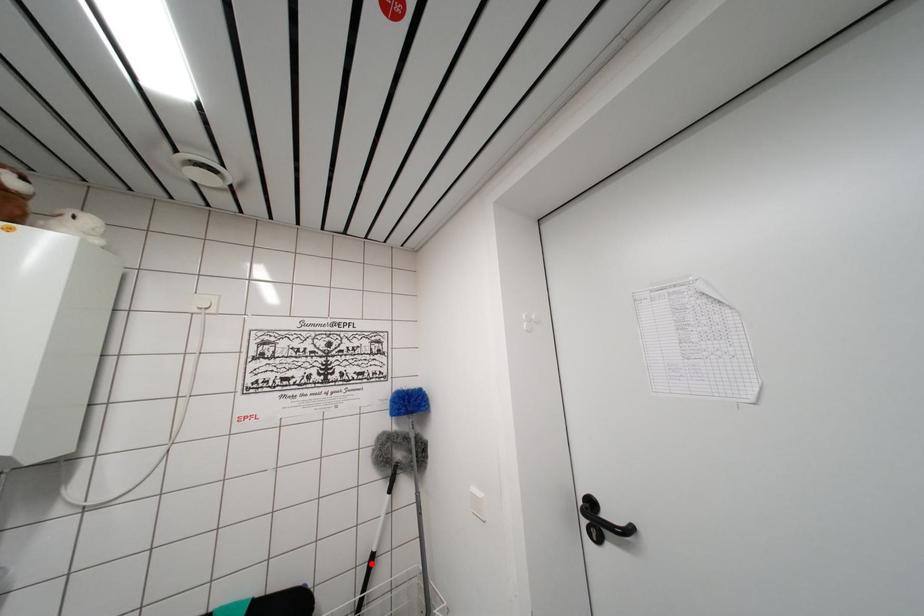
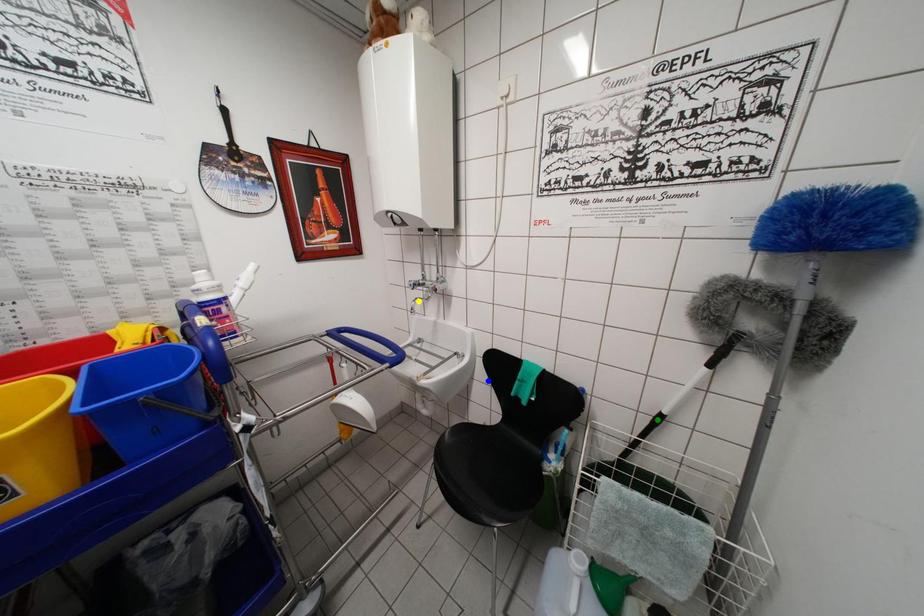
Question: I am providing you with two images of the same scene from different viewpoints. A red point is marked on the first image. You are given multiple points on the second image. Can you choose the point in image 2 that corresponds to the point in image 1?

Choices:
 (A) yellow point
 (B) green point
 (C) blue point

Answer: (B)